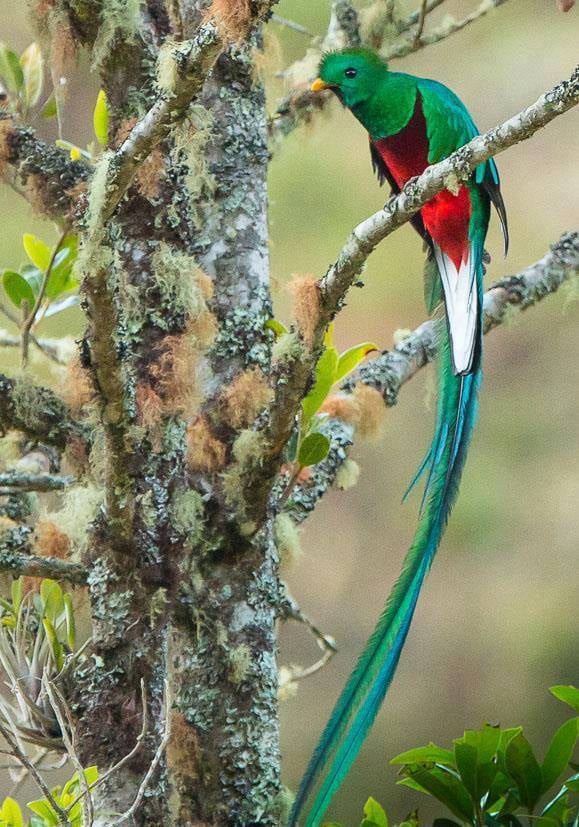
This screenshot has width=579, height=827. I want to click on chest, so click(404, 155).